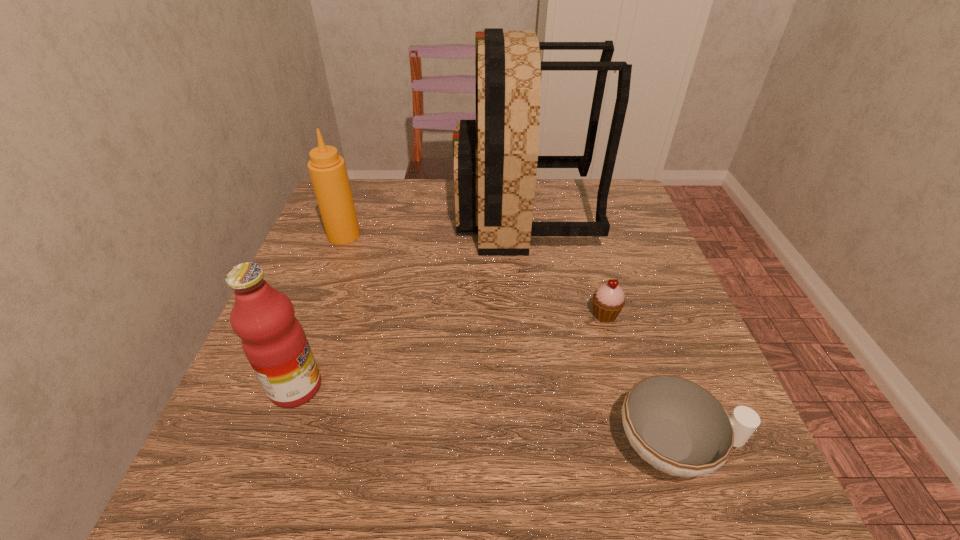
The height and width of the screenshot is (540, 960). I want to click on vacant space in between the chinaware and the backpack, so click(600, 329).

Identify the location of free space between the third nearest object and the condiment. The image size is (960, 540). (474, 275).

Locate an element on the screen. vacant region between the chinaware and the tallest object is located at coordinates (600, 329).

Locate an element on the screen. Image resolution: width=960 pixels, height=540 pixels. vacant point located between the chinaware and the fruit juice is located at coordinates (486, 416).

Where is `free space between the backpack and the fruit juice`? The height and width of the screenshot is (540, 960). free space between the backpack and the fruit juice is located at coordinates (410, 300).

Locate an element on the screen. empty space between the backpack and the fruit juice is located at coordinates (410, 300).

Identify which object is the nearest to the chinaware. Please provide its 2D coordinates. Your answer should be formatted as a tuple, i.e. [(x, y)], where the tuple contains the x and y coordinates of a point satisfying the conditions above.

[(609, 299)]

At what (x,y) coordinates should I click in order to perform the action: click on the closest object to the condiment. Please return your answer as a coordinate pair (x, y). Looking at the image, I should click on (495, 158).

Where is `free space in the image that satisfies the following two spatial constraints: 1. on the front face of the cupcake; 2. on the right side of the backpack`? This screenshot has width=960, height=540. free space in the image that satisfies the following two spatial constraints: 1. on the front face of the cupcake; 2. on the right side of the backpack is located at coordinates (537, 314).